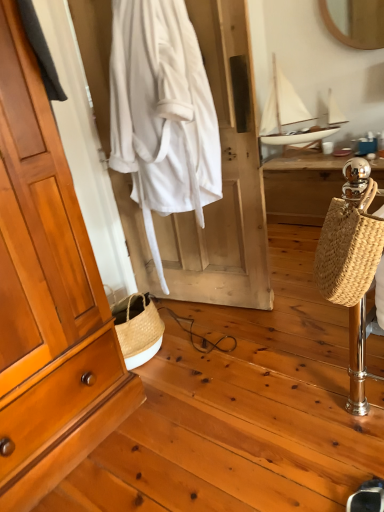
Question: Can you confirm if woven wood desk at right is smaller than black suede shoe at lower right?

Choices:
 (A) yes
 (B) no

Answer: (B)

Question: From the image's perspective, does woven wood desk at right appear lower than black suede shoe at lower right?

Choices:
 (A) no
 (B) yes

Answer: (A)

Question: Is woven wood desk at right not near black suede shoe at lower right?

Choices:
 (A) no
 (B) yes

Answer: (B)

Question: Is woven wood desk at right outside of black suede shoe at lower right?

Choices:
 (A) no
 (B) yes

Answer: (B)

Question: Is woven wood desk at right positioned before black suede shoe at lower right?

Choices:
 (A) no
 (B) yes

Answer: (A)

Question: Would you say black suede shoe at lower right is to the left or to the right of white cotton robe at center in the picture?

Choices:
 (A) left
 (B) right

Answer: (B)

Question: From the image's perspective, is black suede shoe at lower right above or below white cotton robe at center?

Choices:
 (A) below
 (B) above

Answer: (A)

Question: Based on their sizes in the image, would you say black suede shoe at lower right is bigger or smaller than white cotton robe at center?

Choices:
 (A) small
 (B) big

Answer: (A)

Question: Considering the positions of black suede shoe at lower right and white cotton robe at center in the image, is black suede shoe at lower right wider or thinner than white cotton robe at center?

Choices:
 (A) thin
 (B) wide

Answer: (A)

Question: Looking at the image, does white cotton robe at center seem bigger or smaller compared to black suede shoe at lower right?

Choices:
 (A) small
 (B) big

Answer: (B)

Question: Considering the positions of white cotton robe at center and black suede shoe at lower right in the image, is white cotton robe at center taller or shorter than black suede shoe at lower right?

Choices:
 (A) short
 (B) tall

Answer: (B)

Question: Is white cotton robe at center in front of or behind black suede shoe at lower right in the image?

Choices:
 (A) behind
 (B) front

Answer: (A)

Question: From a real-world perspective, is white cotton robe at center positioned above or below black suede shoe at lower right?

Choices:
 (A) below
 (B) above

Answer: (B)

Question: Is woven straw bag at right to the left or to the right of white cotton robe at center in the image?

Choices:
 (A) right
 (B) left

Answer: (A)

Question: Considering the positions of woven straw bag at right and white cotton robe at center in the image, is woven straw bag at right bigger or smaller than white cotton robe at center?

Choices:
 (A) big
 (B) small

Answer: (B)